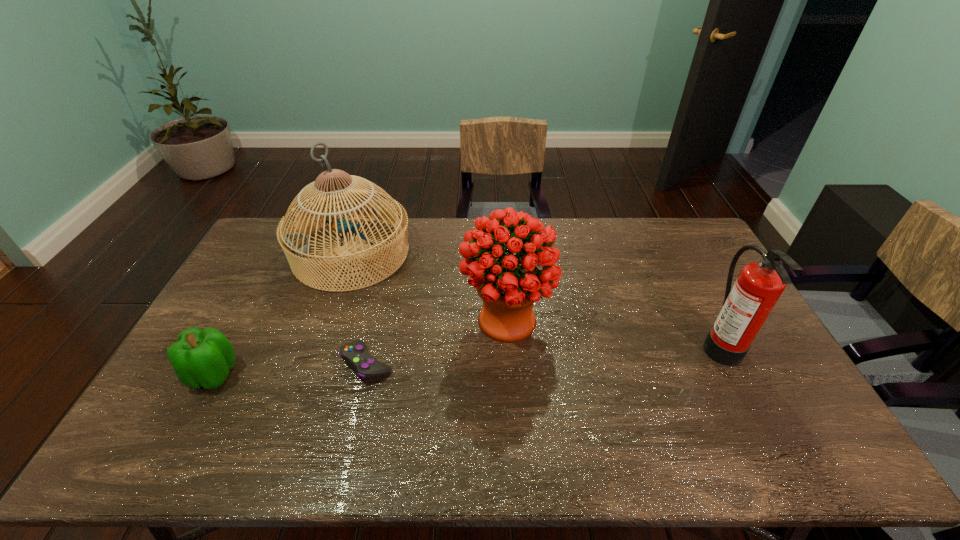
At what (x,y) coordinates should I click in order to perform the action: click on vacant space at the right edge of the desktop. Please return your answer as a coordinate pair (x, y). Looking at the image, I should click on (689, 279).

Image resolution: width=960 pixels, height=540 pixels. I want to click on vacant space at the near left corner of the desktop, so click(x=132, y=448).

What are the coordinates of `empty location between the bouquet and the birdcage` in the screenshot? It's located at (429, 287).

Image resolution: width=960 pixels, height=540 pixels. I want to click on empty location between the control and the birdcage, so click(x=359, y=308).

Find the location of a particular element. The width and height of the screenshot is (960, 540). vacant space that's between the rightmost object and the second object from right to left is located at coordinates (612, 332).

At what (x,y) coordinates should I click in order to perform the action: click on free spot between the bouquet and the birdcage. Please return your answer as a coordinate pair (x, y). The image size is (960, 540). Looking at the image, I should click on (429, 287).

Locate an element on the screen. Image resolution: width=960 pixels, height=540 pixels. free point between the birdcage and the shortest object is located at coordinates (359, 308).

Where is `empty space that is in between the birdcage and the bouquet`? The width and height of the screenshot is (960, 540). empty space that is in between the birdcage and the bouquet is located at coordinates (429, 287).

The image size is (960, 540). Find the location of `free space between the rightmost object and the shortest object`. free space between the rightmost object and the shortest object is located at coordinates (543, 354).

Identify the location of free space between the birdcage and the bouquet. This screenshot has width=960, height=540. (429, 287).